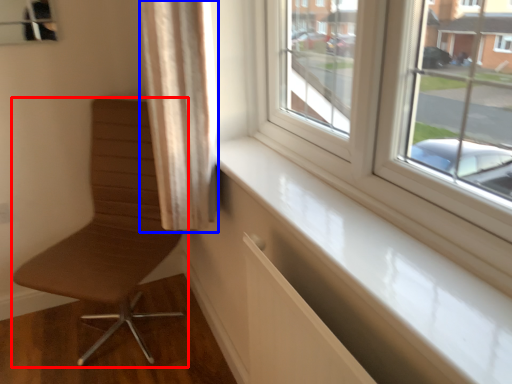
Question: Which point is closer to the camera, chair (highlighted by a red box) or curtain (highlighted by a blue box)?

Choices:
 (A) chair
 (B) curtain

Answer: (B)